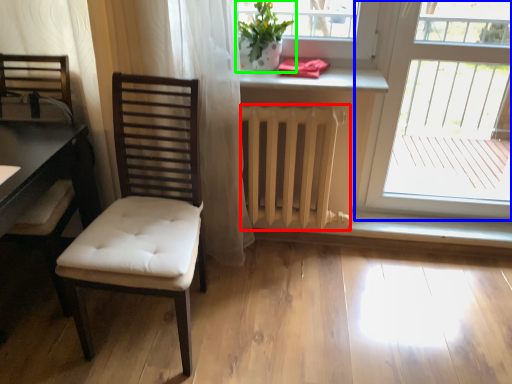
Question: Based on their relative distances, which object is farther from radiator (highlighted by a red box)? Choose from window (highlighted by a blue box) and houseplant (highlighted by a green box).

Choices:
 (A) window
 (B) houseplant

Answer: (A)